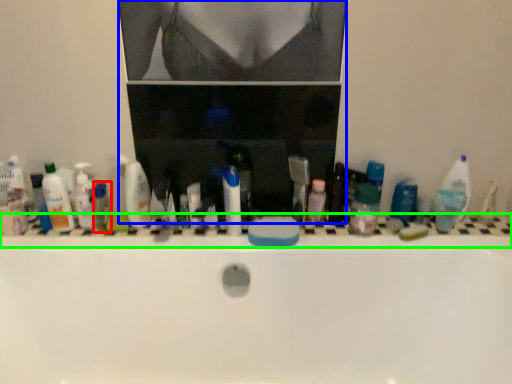
Question: Which object is positioned closest to toiletry (highlighted by a red box)? Select from medicine cabinet (highlighted by a blue box) and ledge (highlighted by a green box).

Choices:
 (A) medicine cabinet
 (B) ledge

Answer: (A)